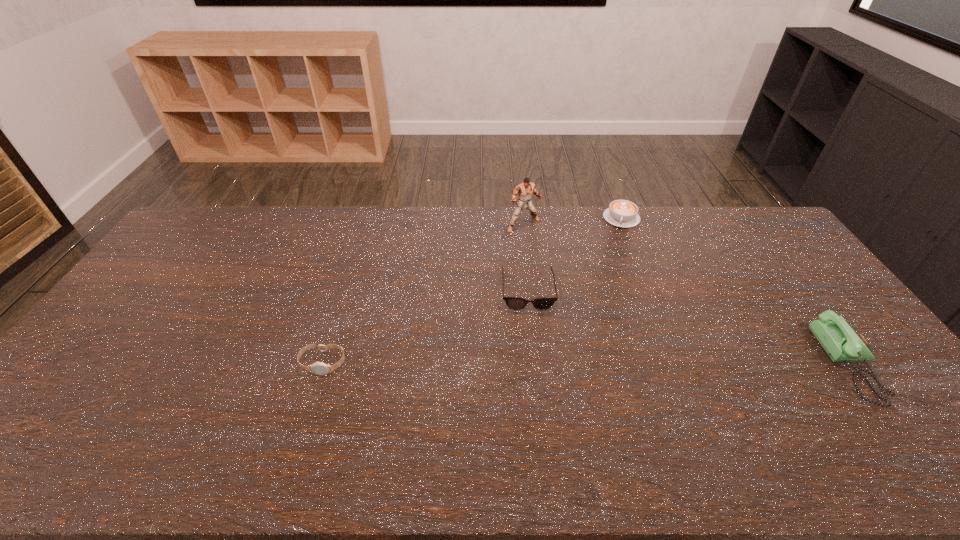
This screenshot has height=540, width=960. Identify the location of free spot between the puncher and the watch. (423, 294).

Identify the location of free space between the cappuccino and the watch. The width and height of the screenshot is (960, 540). (472, 291).

Image resolution: width=960 pixels, height=540 pixels. Identify the location of empty location between the telephone and the third nearest object. (688, 328).

Where is `free space between the cappuccino and the tallest object`? free space between the cappuccino and the tallest object is located at coordinates (572, 221).

Identify the location of vacant region between the third farthest object and the watch. (425, 327).

Where is `empty space between the puncher and the fourth object from left to right`? This screenshot has height=540, width=960. empty space between the puncher and the fourth object from left to right is located at coordinates (572, 221).

Point out which object is positioned as the third nearest to the rightmost object. Please provide its 2D coordinates. Your answer should be formatted as a tuple, i.e. [(x, y)], where the tuple contains the x and y coordinates of a point satisfying the conditions above.

[(525, 189)]

Where is `object identified as the second closest to the sunglasses`? object identified as the second closest to the sunglasses is located at coordinates (622, 213).

The image size is (960, 540). What are the coordinates of `free spot that satisfies the following two spatial constraints: 1. on the face of the telephone; 2. on the dial of the watch` in the screenshot? It's located at (323, 365).

Find the location of a particular element. This screenshot has height=540, width=960. vacant area in the image that satisfies the following two spatial constraints: 1. on the face of the rightmost object; 2. on the dial of the leftmost object is located at coordinates (323, 365).